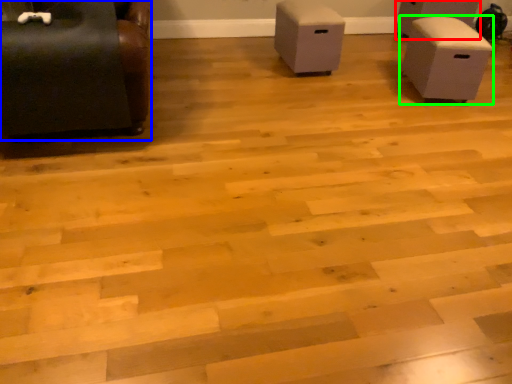
Question: Estimate the real-world distances between objects in this image. Which object is farther from furniture (highlighted by a red box), furniture (highlighted by a blue box) or furniture (highlighted by a green box)?

Choices:
 (A) furniture
 (B) furniture

Answer: (A)